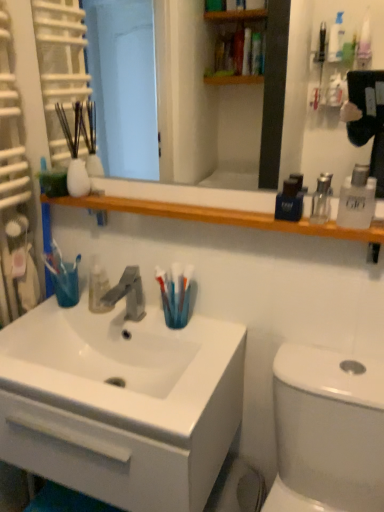
Where is `empty space that is ontop of wooden shelf at upper center (from a real-world perspective)`? Image resolution: width=384 pixels, height=512 pixels. empty space that is ontop of wooden shelf at upper center (from a real-world perspective) is located at coordinates (201, 206).